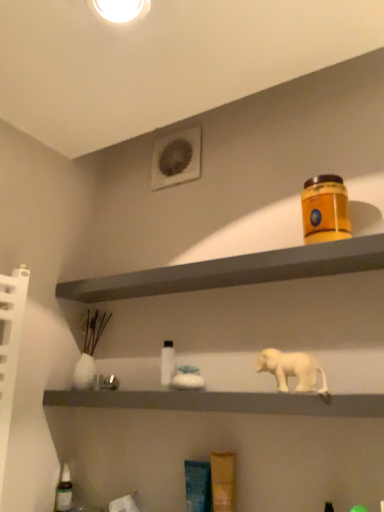
This screenshot has height=512, width=384. I want to click on orange matte jar at upper right, so click(x=325, y=209).

Locate an element on the screen. matte orange container at upper right, the second shelf from the bottom is located at coordinates (234, 271).

Image resolution: width=384 pixels, height=512 pixels. Describe the element at coordinates (176, 158) in the screenshot. I see `white plastic air conditioning unit at upper center` at that location.

Identify the location of white glossy bottle at center, the first bottle in the top-to-bottom sequence. coord(167,362).

Locate an element on the screen. The height and width of the screenshot is (512, 384). orange matte jar at upper right is located at coordinates (325, 209).

From the image's perspective, is white glossy bottle at center, placed as the first bottle when sorted from right to left, above or below white matte elephant at center?

white glossy bottle at center, placed as the first bottle when sorted from right to left, is below white matte elephant at center.

Is white glossy bottle at center, the first bottle in the top-to-bottom sequence, to the right of white matte elephant at center from the viewer's perspective?

No.

From a real-world perspective, which is physically below, white glossy bottle at center, placed as the first bottle when sorted from right to left, or white matte elephant at center?

white matte elephant at center.

From the image's perspective, which one is positioned lower, white matte elephant at center or white matte elephant at center, the 2th shelf in the top-to-bottom sequence?

white matte elephant at center, the 2th shelf in the top-to-bottom sequence, from the image's perspective.

From a real-world perspective, is white matte elephant at center physically below white matte elephant at center, the 2th shelf in the top-to-bottom sequence?

No.

In the image, there is a white matte elephant at center, the 2th shelf in the top-to-bottom sequence. Where is `elephant above it (from the image's perspective)`? The height and width of the screenshot is (512, 384). elephant above it (from the image's perspective) is located at coordinates (291, 369).

Is white matte elephant at center in contact with white matte elephant at center, placed as the 1th shelf when sorted from bottom to top?

No, white matte elephant at center is not in contact with white matte elephant at center, placed as the 1th shelf when sorted from bottom to top.

From the image's perspective, which one is positioned lower, matte orange container at upper right, the second shelf from the bottom, or white plastic air conditioning unit at upper center?

matte orange container at upper right, the second shelf from the bottom, appears lower in the image.

Is matte orange container at upper right, the second shelf from the bottom, outside of white plastic air conditioning unit at upper center?

That's correct, matte orange container at upper right, the second shelf from the bottom, is outside of white plastic air conditioning unit at upper center.

What's the angular difference between matte orange container at upper right, the second shelf from the bottom, and white plastic air conditioning unit at upper center's facing directions?

matte orange container at upper right, the second shelf from the bottom, and white plastic air conditioning unit at upper center are facing 0.00484 degrees away from each other.

Is there a large distance between matte orange container at upper right, the second shelf from the bottom, and white plastic air conditioning unit at upper center?

matte orange container at upper right, the second shelf from the bottom, is actually quite close to white plastic air conditioning unit at upper center.

Who is smaller, white matte elephant at center or white glossy bottle at center, the first bottle in the top-to-bottom sequence?

white glossy bottle at center, the first bottle in the top-to-bottom sequence.

Is white matte elephant at center inside or outside of white glossy bottle at center, which is the second bottle from bottom to top?

white matte elephant at center is located beyond the bounds of white glossy bottle at center, which is the second bottle from bottom to top.

Is white matte elephant at center turned away from white glossy bottle at center, placed as the first bottle when sorted from right to left?

No, white glossy bottle at center, placed as the first bottle when sorted from right to left, is not at the back of white matte elephant at center.

Considering the sizes of objects white matte elephant at center and white glossy bottle at center, placed as the first bottle when sorted from right to left, in the image provided, who is taller, white matte elephant at center or white glossy bottle at center, placed as the first bottle when sorted from right to left,?

Standing taller between the two is white glossy bottle at center, placed as the first bottle when sorted from right to left.

Visually, is white plastic air conditioning unit at upper center positioned to the left or to the right of white matte elephant at center?

From the image, it's evident that white plastic air conditioning unit at upper center is to the left of white matte elephant at center.

Does white plastic air conditioning unit at upper center have a greater height compared to white matte elephant at center?

Indeed, white plastic air conditioning unit at upper center has a greater height compared to white matte elephant at center.

From the picture: Can you tell me how much white plastic air conditioning unit at upper center and white matte elephant at center differ in facing direction?

white plastic air conditioning unit at upper center and white matte elephant at center are facing 0.00261 degrees away from each other.

Is point (180, 137) closer to viewer compared to point (322, 375)?

No.

From a real-world perspective, is white plastic air conditioning unit at upper center above or below translucent glass bottle at lower left, which is counted as the 1th bottle, starting from the left?

From a real-world perspective, white plastic air conditioning unit at upper center is physically above translucent glass bottle at lower left, which is counted as the 1th bottle, starting from the left.

From the image's perspective, does white plastic air conditioning unit at upper center appear higher than translucent glass bottle at lower left, placed as the 1th bottle when sorted from bottom to top?

Yes.

Considering the relative sizes of white plastic air conditioning unit at upper center and translucent glass bottle at lower left, which appears as the second bottle when viewed from the right, in the image provided, is white plastic air conditioning unit at upper center smaller than translucent glass bottle at lower left, which appears as the second bottle when viewed from the right,?

No.

Can you confirm if white plastic air conditioning unit at upper center is wider than translucent glass bottle at lower left, which appears as the second bottle when viewed from the top?

No.

From the image's perspective, which object appears higher, translucent glass bottle at lower left, placed as the 1th bottle when sorted from bottom to top, or white matte elephant at center?

white matte elephant at center appears higher in the image.

How many degrees apart are the facing directions of translucent glass bottle at lower left, placed as the 1th bottle when sorted from bottom to top, and white matte elephant at center?

0.00275 degrees separate the facing orientations of translucent glass bottle at lower left, placed as the 1th bottle when sorted from bottom to top, and white matte elephant at center.

Starting from the white matte elephant at center, which bottle is the 2nd one behind? Please provide its 2D coordinates.

[(64, 490)]

The width and height of the screenshot is (384, 512). Identify the location of bottle that appears above the white matte elephant at center (from a real-world perspective). point(167,362).

You are a GUI agent. You are given a task and a screenshot of the screen. Output one action in this format:
    pyautogui.click(x=<x>, y=<y>)
    Task: Click on the elephant behind the white matte elephant at center, the 2th shelf in the top-to-bottom sequence
    This screenshot has height=512, width=384.
    Given the screenshot: What is the action you would take?
    pyautogui.click(x=291, y=369)

Estimate the real-world distances between objects in this image. Which object is closer to white glossy bottle at center, marked as the 2th bottle in a left-to-right arrangement, white matte elephant at center, the 2th shelf in the top-to-bottom sequence, or translucent glass bottle at lower left, placed as the 1th bottle when sorted from bottom to top?

The object closer to white glossy bottle at center, marked as the 2th bottle in a left-to-right arrangement, is white matte elephant at center, the 2th shelf in the top-to-bottom sequence.

Based on their spatial positions, is white matte elephant at center or white glossy bottle at center, marked as the 2th bottle in a left-to-right arrangement, further from translucent glass bottle at lower left, which appears as the second bottle when viewed from the top?

white matte elephant at center is positioned further to the anchor translucent glass bottle at lower left, which appears as the second bottle when viewed from the top.

Estimate the real-world distances between objects in this image. Which object is further from white matte elephant at center, the 2th shelf in the top-to-bottom sequence, orange matte jar at upper right or white glossy bottle at center, placed as the first bottle when sorted from right to left?

Based on the image, orange matte jar at upper right appears to be further to white matte elephant at center, the 2th shelf in the top-to-bottom sequence.

Looking at the image, which one is located closer to orange matte jar at upper right, translucent glass bottle at lower left, which appears as the second bottle when viewed from the right, or white glossy bottle at center, the first bottle in the top-to-bottom sequence?

white glossy bottle at center, the first bottle in the top-to-bottom sequence, is positioned closer to the anchor orange matte jar at upper right.

Estimate the real-world distances between objects in this image. Which object is further from translucent glass bottle at lower left, which is counted as the 1th bottle, starting from the left, white matte elephant at center, placed as the 1th shelf when sorted from bottom to top, or matte orange container at upper right, which ranks as the first shelf in top-to-bottom order?

matte orange container at upper right, which ranks as the first shelf in top-to-bottom order, is further to translucent glass bottle at lower left, which is counted as the 1th bottle, starting from the left.

Estimate the real-world distances between objects in this image. Which object is closer to orange matte jar at upper right, white matte elephant at center, placed as the 1th shelf when sorted from bottom to top, or translucent glass bottle at lower left, which appears as the second bottle when viewed from the top?

white matte elephant at center, placed as the 1th shelf when sorted from bottom to top, is closer to orange matte jar at upper right.

Which object lies further to the anchor point white matte elephant at center, the 2th shelf in the top-to-bottom sequence, orange matte jar at upper right or white matte elephant at center?

Among the two, orange matte jar at upper right is located further to white matte elephant at center, the 2th shelf in the top-to-bottom sequence.

Based on their spatial positions, is orange matte jar at upper right or white plastic air conditioning unit at upper center closer to white matte elephant at center, the 2th shelf in the top-to-bottom sequence?

orange matte jar at upper right lies closer to white matte elephant at center, the 2th shelf in the top-to-bottom sequence, than the other object.

Locate an element on the screen. bottle between translucent glass bottle at lower left, which appears as the second bottle when viewed from the right, and white matte elephant at center from left to right is located at coordinates (167, 362).

Identify the location of shelf that lies between orange matte jar at upper right and white glossy bottle at center, marked as the 2th bottle in a left-to-right arrangement, from top to bottom. (234, 271).

You are a GUI agent. You are given a task and a screenshot of the screen. Output one action in this format:
    pyautogui.click(x=<x>, y=<y>)
    Task: Click on the product positioned between matte orange container at upper right, which ranks as the first shelf in top-to-bottom order, and white plastic air conditioning unit at upper center from near to far
    This screenshot has height=512, width=384.
    Given the screenshot: What is the action you would take?
    pyautogui.click(x=325, y=209)

You are a GUI agent. You are given a task and a screenshot of the screen. Output one action in this format:
    pyautogui.click(x=<x>, y=<y>)
    Task: Click on the product between white plastic air conditioning unit at upper center and translucent glass bottle at lower left, which appears as the second bottle when viewed from the right, from top to bottom
    The width and height of the screenshot is (384, 512).
    Given the screenshot: What is the action you would take?
    pyautogui.click(x=325, y=209)